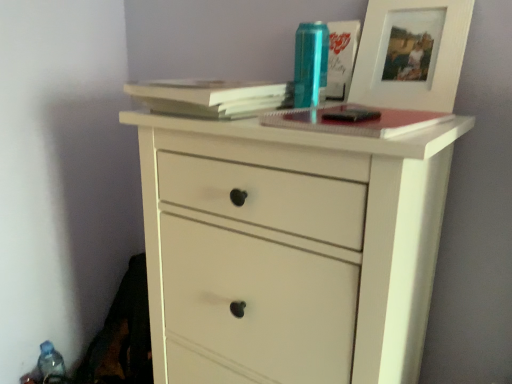
What is the approximate width of white matte chest of drawers at center?

It is 17.79 inches.

The image size is (512, 384). Identify the location of light brown paper at upper center, positioned as the 2th paperback book in right-to-left order. (211, 97).

Identify the location of hardcover notebook at center, which ranks as the 2th paperback book in left-to-right order. This screenshot has width=512, height=384. (355, 120).

The width and height of the screenshot is (512, 384). Identify the location of white wood picture frame at upper right. (x=412, y=53).

This screenshot has height=384, width=512. Identify the location of metallic blue can at upper center, which ranks as the second bottle in bottom-to-top order. (310, 63).

Which object is thinner, light brown paper at upper center, positioned as the 2th paperback book in right-to-left order, or white wood picture frame at upper right?

Thinner between the two is white wood picture frame at upper right.

Which object is more forward, light brown paper at upper center, positioned as the 1th paperback book in left-to-right order, or white wood picture frame at upper right?

light brown paper at upper center, positioned as the 1th paperback book in left-to-right order.

From a real-world perspective, is light brown paper at upper center, positioned as the 1th paperback book in left-to-right order, above or below white wood picture frame at upper right?

In terms of real-world spatial position, light brown paper at upper center, positioned as the 1th paperback book in left-to-right order, is below white wood picture frame at upper right.

Considering the relative positions of light brown paper at upper center, positioned as the 1th paperback book in left-to-right order, and white wood picture frame at upper right in the image provided, is light brown paper at upper center, positioned as the 1th paperback book in left-to-right order, to the left of white wood picture frame at upper right from the viewer's perspective?

Correct, you'll find light brown paper at upper center, positioned as the 1th paperback book in left-to-right order, to the left of white wood picture frame at upper right.

From the image's perspective, is hardcover notebook at center, the first paperback book from the right, over light brown paper at upper center, positioned as the 1th paperback book in left-to-right order?

Actually, hardcover notebook at center, the first paperback book from the right, appears below light brown paper at upper center, positioned as the 1th paperback book in left-to-right order, in the image.

Considering the sizes of objects hardcover notebook at center, the first paperback book from the right, and light brown paper at upper center, positioned as the 2th paperback book in right-to-left order, in the image provided, who is shorter, hardcover notebook at center, the first paperback book from the right, or light brown paper at upper center, positioned as the 2th paperback book in right-to-left order,?

Standing shorter between the two is hardcover notebook at center, the first paperback book from the right.

Would you say hardcover notebook at center, which ranks as the 2th paperback book in left-to-right order, is outside light brown paper at upper center, positioned as the 1th paperback book in left-to-right order?

hardcover notebook at center, which ranks as the 2th paperback book in left-to-right order, lies outside light brown paper at upper center, positioned as the 1th paperback book in left-to-right order,'s area.

From a real-world perspective, which object stands above the other?

From a 3D spatial view, hardcover notebook at center, the first paperback book from the right, is above.

Is blue plastic bottle at lower left, the first bottle from the left, thinner than hardcover notebook at center, which ranks as the 2th paperback book in left-to-right order?

Indeed, blue plastic bottle at lower left, the first bottle from the left, has a lesser width compared to hardcover notebook at center, which ranks as the 2th paperback book in left-to-right order.

Considering the sizes of objects blue plastic bottle at lower left, the second bottle when ordered from right to left, and hardcover notebook at center, the first paperback book from the right, in the image provided, who is taller, blue plastic bottle at lower left, the second bottle when ordered from right to left, or hardcover notebook at center, the first paperback book from the right,?

Standing taller between the two is blue plastic bottle at lower left, the second bottle when ordered from right to left.

Is metallic blue can at upper center, positioned as the 1th bottle in front-to-back order, in contact with white matte chest of drawers at center?

There is a gap between metallic blue can at upper center, positioned as the 1th bottle in front-to-back order, and white matte chest of drawers at center.

From a real-world perspective, is metallic blue can at upper center, which ranks as the second bottle in bottom-to-top order, positioned over white matte chest of drawers at center based on gravity?

Correct, in the physical world, metallic blue can at upper center, which ranks as the second bottle in bottom-to-top order, is higher than white matte chest of drawers at center.

Who is taller, metallic blue can at upper center, which ranks as the second bottle in bottom-to-top order, or white matte chest of drawers at center?

white matte chest of drawers at center.

What's the angular difference between metallic blue can at upper center, the first bottle positioned from the top, and white matte chest of drawers at center's facing directions?

The facing directions of metallic blue can at upper center, the first bottle positioned from the top, and white matte chest of drawers at center are 2.47 degrees apart.

From the picture: From the image's perspective, who appears lower, blue plastic bottle at lower left, which is the first bottle from bottom to top, or white matte chest of drawers at center?

blue plastic bottle at lower left, which is the first bottle from bottom to top.

Which is more to the left, blue plastic bottle at lower left, placed as the 2th bottle when sorted from top to bottom, or white matte chest of drawers at center?

blue plastic bottle at lower left, placed as the 2th bottle when sorted from top to bottom, is more to the left.

Find the location of a particular element. This screenshot has width=512, height=384. chest of drawers on the right of blue plastic bottle at lower left, placed as the 2th bottle when sorted from top to bottom is located at coordinates (290, 249).

Is hardcover notebook at center, which ranks as the 2th paperback book in left-to-right order, turned away from metallic blue can at upper center, which is the second bottle in back-to-front order?

No, metallic blue can at upper center, which is the second bottle in back-to-front order, is not at the back of hardcover notebook at center, which ranks as the 2th paperback book in left-to-right order.

Locate an element on the screen. bottle that is the 1st object to the left of the hardcover notebook at center, the first paperback book from the right, starting at the anchor is located at coordinates (310, 63).

From the image's perspective, which is below, hardcover notebook at center, which ranks as the 2th paperback book in left-to-right order, or metallic blue can at upper center, which ranks as the second bottle in bottom-to-top order?

hardcover notebook at center, which ranks as the 2th paperback book in left-to-right order, is shown below in the image.

Is hardcover notebook at center, the first paperback book from the right, not inside metallic blue can at upper center, the first bottle positioned from the top?

Yes.

Is point (316, 116) closer to camera compared to point (61, 377)?

That is True.

Considering the sizes of hardcover notebook at center, which ranks as the 2th paperback book in left-to-right order, and blue plastic bottle at lower left, arranged as the second bottle when viewed from the front, in the image, is hardcover notebook at center, which ranks as the 2th paperback book in left-to-right order, taller or shorter than blue plastic bottle at lower left, arranged as the second bottle when viewed from the front,?

hardcover notebook at center, which ranks as the 2th paperback book in left-to-right order, is shorter than blue plastic bottle at lower left, arranged as the second bottle when viewed from the front.

Is blue plastic bottle at lower left, placed as the 2th bottle when sorted from top to bottom, located within hardcover notebook at center, which ranks as the 2th paperback book in left-to-right order?

Definitely not — blue plastic bottle at lower left, placed as the 2th bottle when sorted from top to bottom, is not inside hardcover notebook at center, which ranks as the 2th paperback book in left-to-right order.

Does hardcover notebook at center, which ranks as the 2th paperback book in left-to-right order, have a lesser width compared to blue plastic bottle at lower left, the first bottle from the left?

No, hardcover notebook at center, which ranks as the 2th paperback book in left-to-right order, is not thinner than blue plastic bottle at lower left, the first bottle from the left.

Identify the location of the 1st paperback book positioned below the white wood picture frame at upper right (from a real-world perspective). (211, 97).

Where is `paperback book behind the hardcover notebook at center, which ranks as the 2th paperback book in left-to-right order`? paperback book behind the hardcover notebook at center, which ranks as the 2th paperback book in left-to-right order is located at coordinates (211, 97).

When comparing their distances from metallic blue can at upper center, which is the second bottle in back-to-front order, does light brown paper at upper center, positioned as the 2th paperback book in right-to-left order, or blue plastic bottle at lower left, which is the first bottle from bottom to top, seem further?

blue plastic bottle at lower left, which is the first bottle from bottom to top.

Based on their spatial positions, is light brown paper at upper center, positioned as the 1th paperback book in left-to-right order, or white matte chest of drawers at center further from metallic blue can at upper center, the first bottle viewed from the right?

white matte chest of drawers at center lies further to metallic blue can at upper center, the first bottle viewed from the right, than the other object.

Which object lies nearer to the anchor point metallic blue can at upper center, the first bottle positioned from the top, blue plastic bottle at lower left, placed as the 2th bottle when sorted from top to bottom, or white wood picture frame at upper right?

The object closer to metallic blue can at upper center, the first bottle positioned from the top, is white wood picture frame at upper right.

From the image, which object appears to be nearer to white wood picture frame at upper right, blue plastic bottle at lower left, placed as the 2th bottle when sorted from top to bottom, or metallic blue can at upper center, which ranks as the second bottle in bottom-to-top order?

metallic blue can at upper center, which ranks as the second bottle in bottom-to-top order.

Considering their positions, is white matte chest of drawers at center positioned further to blue plastic bottle at lower left, placed as the 2th bottle when sorted from top to bottom, than metallic blue can at upper center, the first bottle viewed from the right?

Among the two, metallic blue can at upper center, the first bottle viewed from the right, is located further to blue plastic bottle at lower left, placed as the 2th bottle when sorted from top to bottom.

When comparing their distances from light brown paper at upper center, positioned as the 2th paperback book in right-to-left order, does hardcover notebook at center, which ranks as the 2th paperback book in left-to-right order, or metallic blue can at upper center, the first bottle viewed from the right, seem closer?

The object closer to light brown paper at upper center, positioned as the 2th paperback book in right-to-left order, is metallic blue can at upper center, the first bottle viewed from the right.

From the image, which object appears to be nearer to light brown paper at upper center, positioned as the 2th paperback book in right-to-left order, white wood picture frame at upper right or hardcover notebook at center, the first paperback book from the right?

Based on the image, hardcover notebook at center, the first paperback book from the right, appears to be nearer to light brown paper at upper center, positioned as the 2th paperback book in right-to-left order.

Which object lies nearer to the anchor point white wood picture frame at upper right, hardcover notebook at center, the first paperback book from the right, or white matte chest of drawers at center?

The object closer to white wood picture frame at upper right is hardcover notebook at center, the first paperback book from the right.

I want to click on chest of drawers between blue plastic bottle at lower left, positioned as the first bottle in back-to-front order, and hardcover notebook at center, which ranks as the 2th paperback book in left-to-right order, so click(290, 249).

You are a GUI agent. You are given a task and a screenshot of the screen. Output one action in this format:
    pyautogui.click(x=<x>, y=<y>)
    Task: Click on the paperback book between light brown paper at upper center, positioned as the 1th paperback book in left-to-right order, and white wood picture frame at upper right
    The image size is (512, 384).
    Given the screenshot: What is the action you would take?
    pyautogui.click(x=355, y=120)

I want to click on bottle situated between blue plastic bottle at lower left, the first bottle from the left, and white wood picture frame at upper right from left to right, so click(310, 63).

Locate an element on the screen. Image resolution: width=512 pixels, height=384 pixels. picture frame between hardcover notebook at center, which ranks as the 2th paperback book in left-to-right order, and metallic blue can at upper center, which is the second bottle in back-to-front order, in the front-back direction is located at coordinates (412, 53).